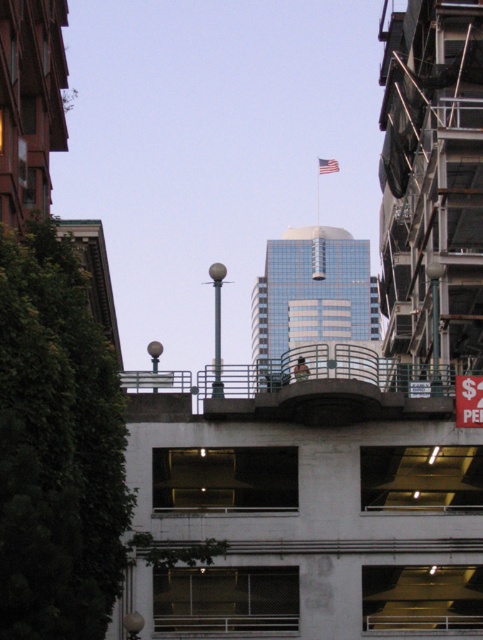
You are standing on the pedestrian bridge and want to take a photo of the glassy reflective skyscraper at center and the red fabric flag at upper center. Which object will appear larger in your photo?

The glassy reflective skyscraper at center will appear larger in the photo because it is closer to the viewer than the red fabric flag at upper center.

You are standing on the pedestrian bridge and want to take a photo of the white concrete parking garage at center and the red fabric flag at upper center. Which object will appear larger in your photo?

The white concrete parking garage at center will appear larger in the photo because it is closer to the viewer than the red fabric flag at upper center.